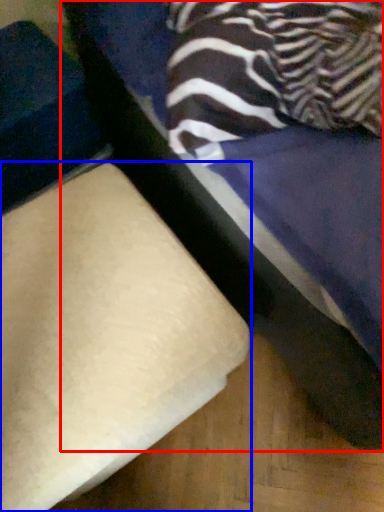
Question: Which of the following is the closest to the observer, furniture (highlighted by a red box) or furniture (highlighted by a blue box)?

Choices:
 (A) furniture
 (B) furniture

Answer: (A)